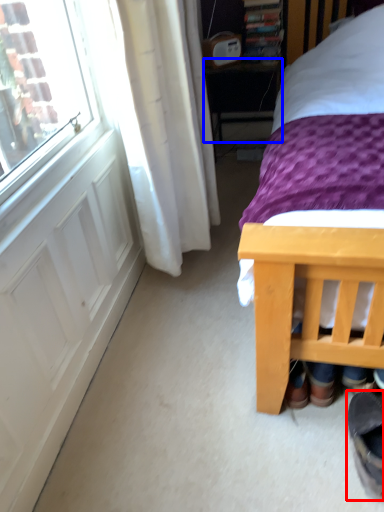
Question: Among these objects, which one is nearest to the camera, footwear (highlighted by a red box) or table (highlighted by a blue box)?

Choices:
 (A) footwear
 (B) table

Answer: (A)